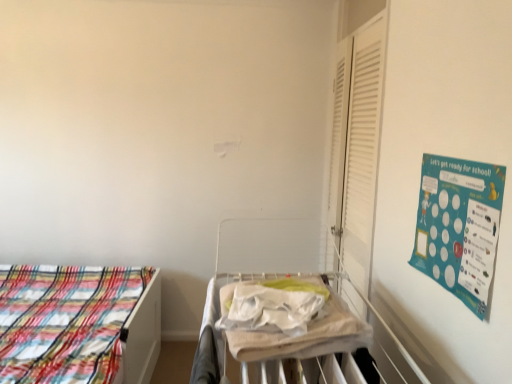
Question: Considering the relative sizes of beige cotton blanket at center and white matte shutter at right in the image provided, is beige cotton blanket at center bigger than white matte shutter at right?

Choices:
 (A) no
 (B) yes

Answer: (A)

Question: Can you confirm if beige cotton blanket at center is wider than white matte shutter at right?

Choices:
 (A) yes
 (B) no

Answer: (A)

Question: From the image's perspective, does beige cotton blanket at center appear higher than white matte shutter at right?

Choices:
 (A) yes
 (B) no

Answer: (B)

Question: Does beige cotton blanket at center have a lesser height compared to white matte shutter at right?

Choices:
 (A) no
 (B) yes

Answer: (B)

Question: Would you say white matte shutter at right is part of beige cotton blanket at center's contents?

Choices:
 (A) yes
 (B) no

Answer: (B)

Question: From the image's perspective, is teal paperboard at upper right located above or below beige cotton blanket at center?

Choices:
 (A) below
 (B) above

Answer: (B)

Question: Is teal paperboard at upper right spatially inside beige cotton blanket at center, or outside of it?

Choices:
 (A) inside
 (B) outside

Answer: (B)

Question: From a real-world perspective, is teal paperboard at upper right positioned above or below beige cotton blanket at center?

Choices:
 (A) above
 (B) below

Answer: (A)

Question: Is teal paperboard at upper right wider or thinner than beige cotton blanket at center?

Choices:
 (A) wide
 (B) thin

Answer: (B)

Question: From the image's perspective, is teal paperboard at upper right positioned above or below plaid fabric bed at left?

Choices:
 (A) above
 (B) below

Answer: (A)

Question: In terms of size, does teal paperboard at upper right appear bigger or smaller than plaid fabric bed at left?

Choices:
 (A) small
 (B) big

Answer: (A)

Question: From their relative heights in the image, would you say teal paperboard at upper right is taller or shorter than plaid fabric bed at left?

Choices:
 (A) short
 (B) tall

Answer: (A)

Question: From a real-world perspective, relative to plaid fabric bed at left, is teal paperboard at upper right vertically above or below?

Choices:
 (A) above
 (B) below

Answer: (A)

Question: Would you say white fabric hospital bed at center is to the left or to the right of white matte shutter at right in the picture?

Choices:
 (A) left
 (B) right

Answer: (A)

Question: Looking at their shapes, would you say white fabric hospital bed at center is wider or thinner than white matte shutter at right?

Choices:
 (A) wide
 (B) thin

Answer: (A)